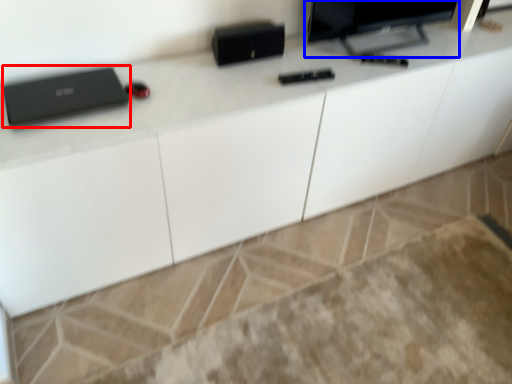
Question: Which object is further to the camera taking this photo, laptop (highlighted by a red box) or computer monitor (highlighted by a blue box)?

Choices:
 (A) laptop
 (B) computer monitor

Answer: (B)